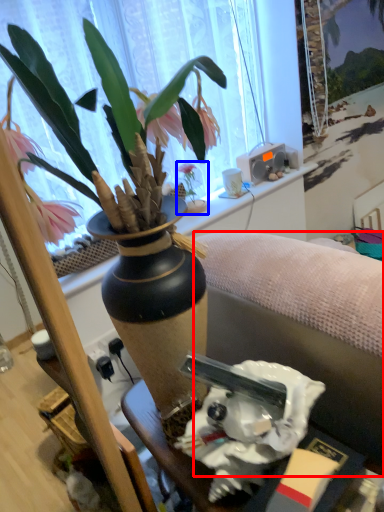
Question: Among these objects, which one is nearest to the camera, studio couch (highlighted by a red box) or houseplant (highlighted by a blue box)?

Choices:
 (A) studio couch
 (B) houseplant

Answer: (A)